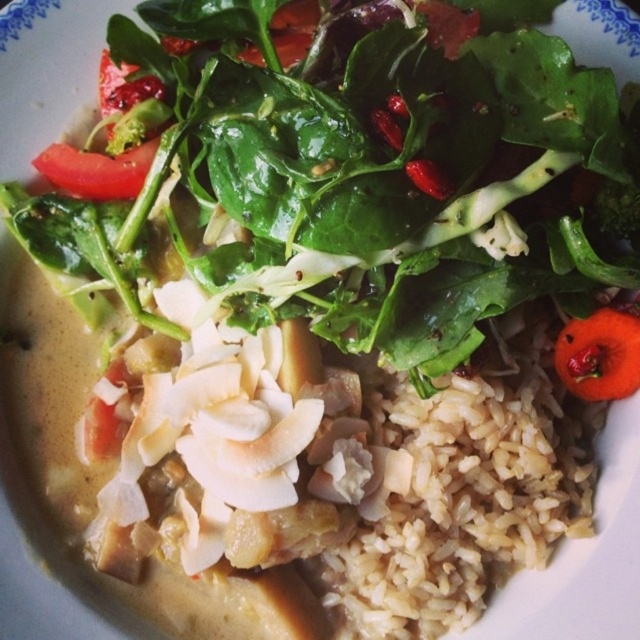
You are a food critic analyzing the placement of ingredients in the dish. The dish has a white plate with blue decorative edges. You notice a red matte tomato at the point with coordinates (x=600, y=355). Where exactly on the plate is this tomato located?

The red matte tomato at upper right is located at the upper right corner of the plate, specifically at the coordinates (x=600, y=355).